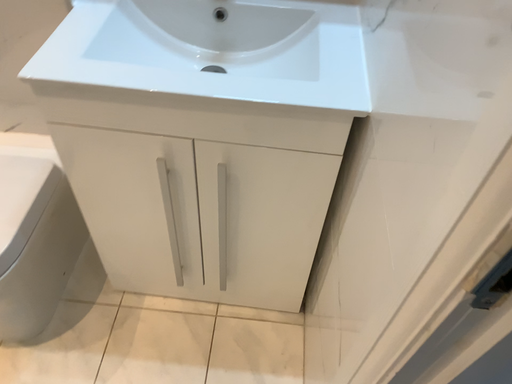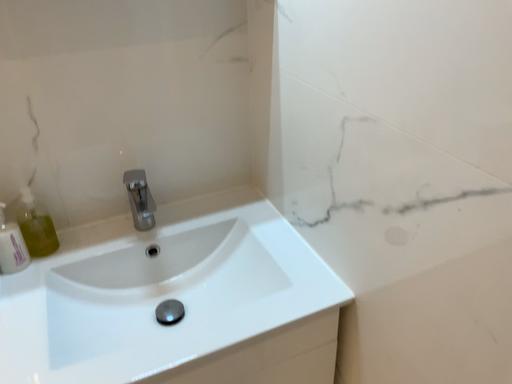
Question: How did the camera likely rotate when shooting the video?

Choices:
 (A) rotated right
 (B) rotated left

Answer: (A)